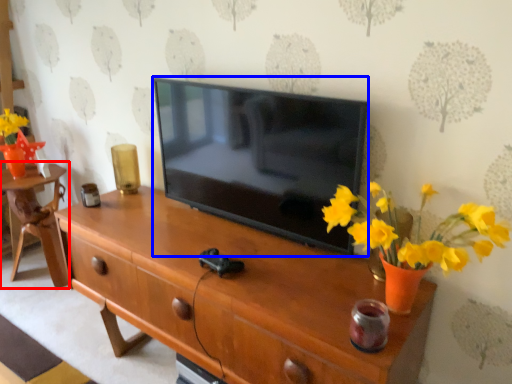
Question: Which object is further to the camera taking this photo, table (highlighted by a red box) or television (highlighted by a blue box)?

Choices:
 (A) table
 (B) television

Answer: (A)